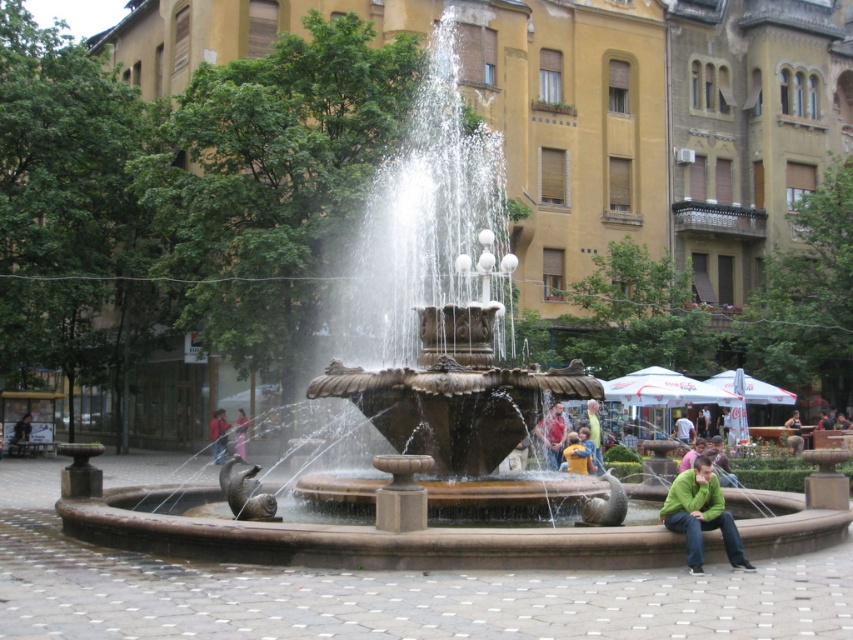
You are standing in the urban square and notice two people wearing jackets. One is wearing a green matte jacket at lower right and the other a matte brown jacket at center. From your perspective, which jacket is positioned lower in the image?

The green matte jacket at lower right is positioned lower than the matte brown jacket at center in the image.

You are a delivery person standing at the fountain in the square. You need to deliver a package to the owner of the matte brown jacket at center and then to the owner of the red fabric jacket at lower left. If your delivery cart can only travel 100 feet before needing a recharge, will you be able to complete both deliveries without recharging?

The matte brown jacket at center and red fabric jacket at lower left are 82.82 feet apart. Since the total distance between them is less than 100 feet, you can complete both deliveries without needing to recharge your cart.

You are standing in the urban square and want to greet both the yellow fabric person at lower right and the red fabric jacket at lower left. Which person should you approach first if you want to start with the one closer to the fountain?

The red fabric jacket at lower left is closer to the fountain than the yellow fabric person at lower right, so you should approach the red fabric jacket at lower left first.